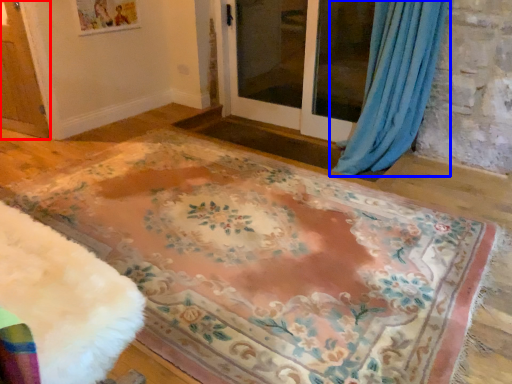
Question: Which object is further to the camera taking this photo, screen door (highlighted by a red box) or curtain (highlighted by a blue box)?

Choices:
 (A) screen door
 (B) curtain

Answer: (A)